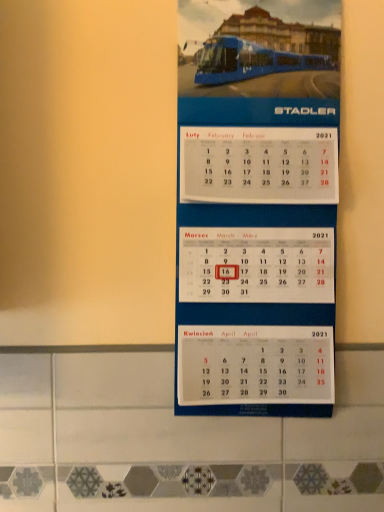
Measure the distance between point (214, 275) and camera.

Point (214, 275) is 80.70 centimeters away from camera.

You are a GUI agent. You are given a task and a screenshot of the screen. Output one action in this format:
    pyautogui.click(x=<x>, y=<y>)
    Task: Click on the white paper calendar at center
    
    Given the screenshot: What is the action you would take?
    pyautogui.click(x=256, y=225)

What do you see at coordinates (256, 225) in the screenshot? I see `white paper calendar at center` at bounding box center [256, 225].

What are the coordinates of `white paper calendar at center` in the screenshot? It's located at (256, 225).